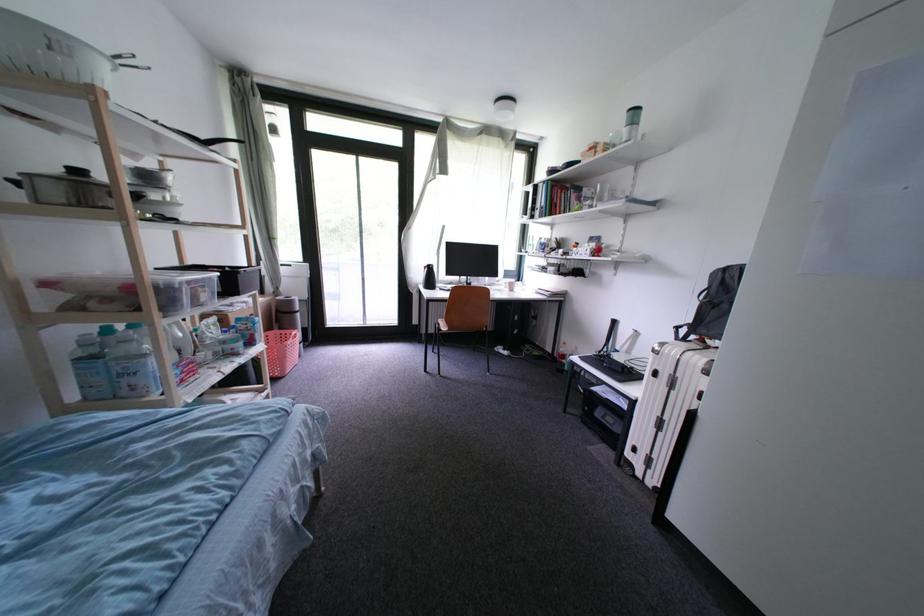
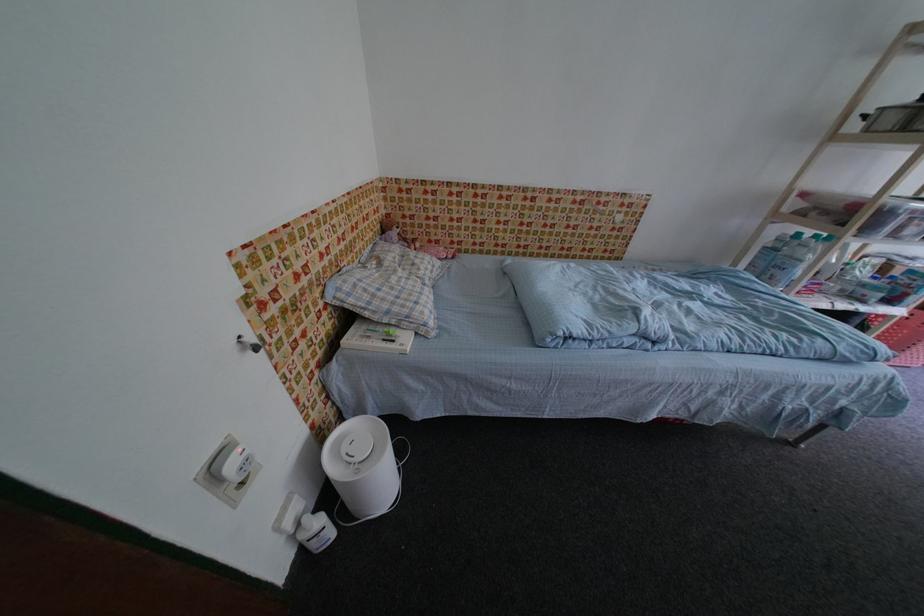
Locate, in the second image, the point that corresponds to pixel 134 383 in the first image.

(782, 274)